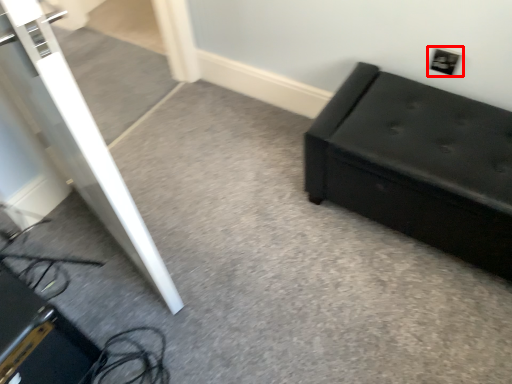
Question: Where is electric outlet (annotated by the red box) located in relation to furniture in the image?

Choices:
 (A) left
 (B) right

Answer: (B)